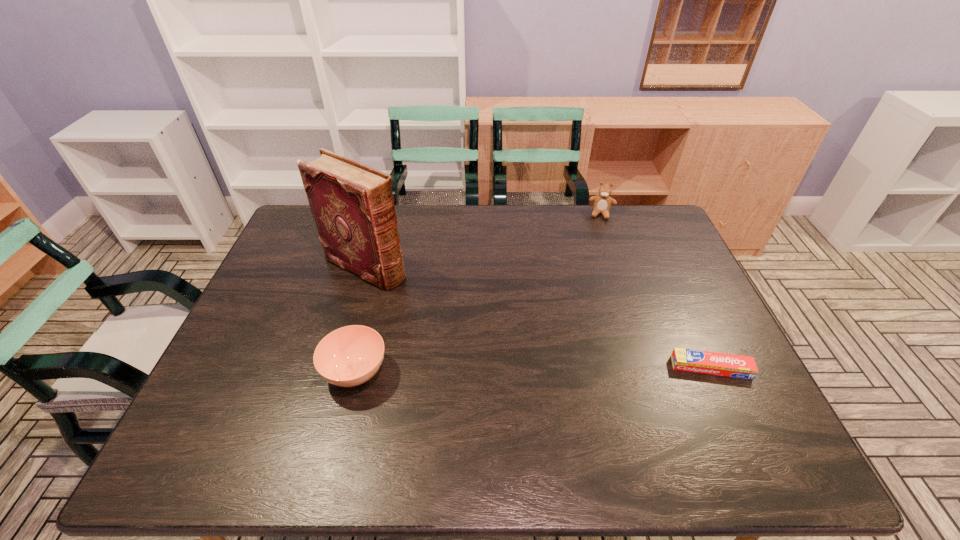
Find the location of `free space that is in between the toothpaste and the second tallest object`. free space that is in between the toothpaste and the second tallest object is located at coordinates (657, 291).

At what (x,y) coordinates should I click in order to perform the action: click on free space between the soup bowl and the shortest object. Please return your answer as a coordinate pair (x, y). Image resolution: width=960 pixels, height=540 pixels. Looking at the image, I should click on 533,369.

This screenshot has height=540, width=960. Find the location of `empty space between the third shortest object and the second shortest object`. empty space between the third shortest object and the second shortest object is located at coordinates (479, 293).

Where is `unoccupied area between the soup bowl and the teddy bear`? This screenshot has width=960, height=540. unoccupied area between the soup bowl and the teddy bear is located at coordinates (479, 293).

Identify the location of free spot between the tallest object and the shortest object. (539, 317).

You are a GUI agent. You are given a task and a screenshot of the screen. Output one action in this format:
    pyautogui.click(x=<x>, y=<y>)
    Task: Click on the closest object to the second farthest object
    
    Given the screenshot: What is the action you would take?
    pyautogui.click(x=349, y=356)

Locate which object ranks third in proximity to the toothpaste. Please provide its 2D coordinates. Your answer should be formatted as a tuple, i.e. [(x, y)], where the tuple contains the x and y coordinates of a point satisfying the conditions above.

[(352, 204)]

Where is `free space that satisfies the following two spatial constraints: 1. on the back side of the toothpaste; 2. on the left side of the soup bowl`? The width and height of the screenshot is (960, 540). free space that satisfies the following two spatial constraints: 1. on the back side of the toothpaste; 2. on the left side of the soup bowl is located at coordinates 356,367.

Identify the location of vacant space that satisfies the following two spatial constraints: 1. on the back side of the second tallest object; 2. on the left side of the third nearest object. Image resolution: width=960 pixels, height=540 pixels. (380, 214).

Find the location of a particular element. The height and width of the screenshot is (540, 960). free location that satisfies the following two spatial constraints: 1. on the back side of the third shortest object; 2. on the right side of the second farthest object is located at coordinates (380, 214).